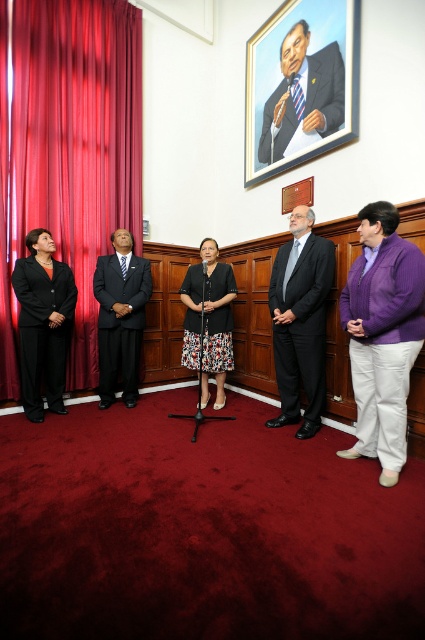
You are standing in the room and want to move from point A to point B. Point A is at coordinate point [214,300] and point B is at coordinate point [333,104]. Which point is closer to you?

Point A at [214,300] is closer to you since it is further to the camera than point B at [333,104].

You are attending a formal event and need to identify the attire of two individuals. Which object is positioned to the left of the other? The black matte suit at left and the blue striped tie at upper center are present in the scene.

The black matte suit at left is positioned to the left of the blue striped tie at upper center.